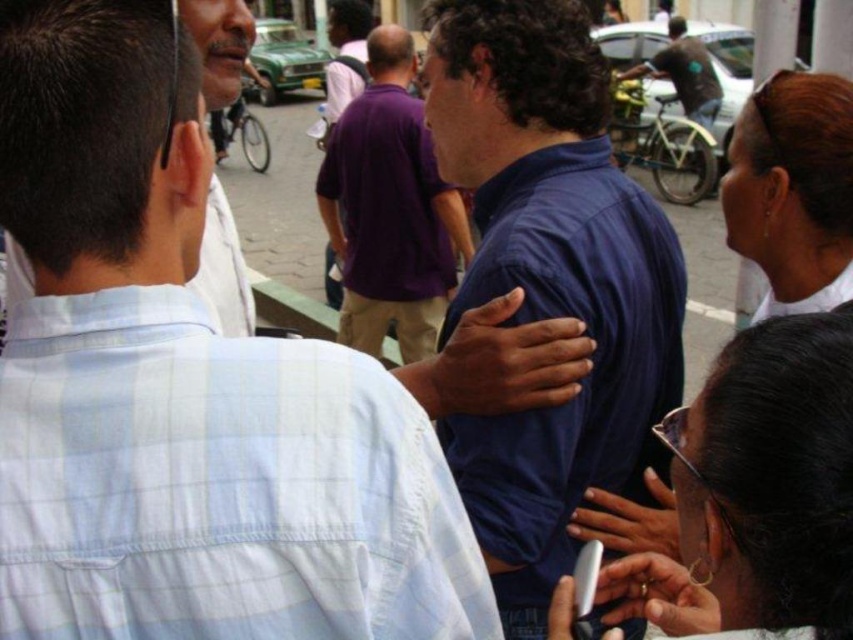
Can you confirm if blue shirt at center is smaller than dark blue shirt at center?

Yes, blue shirt at center is smaller than dark blue shirt at center.

Is blue shirt at center closer to the viewer compared to dark blue shirt at center?

That is True.

Which is in front, point (259, 371) or point (465, 243)?

Point (259, 371) is in front.

Locate an element on the screen. This screenshot has height=640, width=853. blue shirt at center is located at coordinates (184, 392).

Is blue cotton shirt at center taller than dark blue shirt at center?

In fact, blue cotton shirt at center may be shorter than dark blue shirt at center.

Consider the image. Can you confirm if blue cotton shirt at center is positioned to the left of dark blue shirt at center?

Incorrect, blue cotton shirt at center is not on the left side of dark blue shirt at center.

Find the location of a particular element. blue cotton shirt at center is located at coordinates (550, 280).

Where is `blue cotton shirt at center`? The width and height of the screenshot is (853, 640). blue cotton shirt at center is located at coordinates (550, 280).

Is blue shirt at center thinner than light blue plaid shirt at upper left?

No.

Which is behind, point (270, 340) or point (221, 192)?

The point (221, 192) is more distant.

The height and width of the screenshot is (640, 853). What are the coordinates of `blue shirt at center` in the screenshot? It's located at (184, 392).